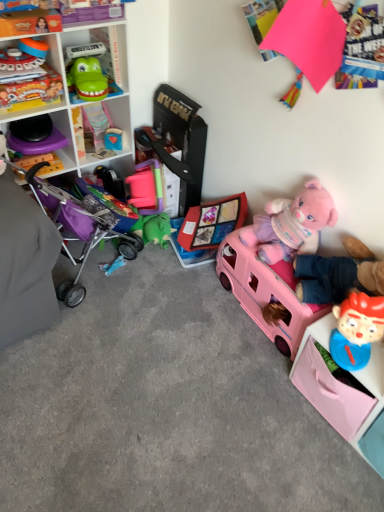
This screenshot has width=384, height=512. In order to click on matte green plastic toy at upper left, which is counted as the first toy, starting from the left in this screenshot , I will do `click(29, 88)`.

The width and height of the screenshot is (384, 512). What do you see at coordinates (344, 393) in the screenshot?
I see `pink plastic shelf at lower right, the 2th shelf viewed from the left` at bounding box center [344, 393].

In order to face matte plastic shelf at upper left, the second shelf when ordered from right to left, should I rotate leftwards or rightwards?

Turn left approximately 17.238 degrees to face it.

This screenshot has width=384, height=512. Find the location of `purple fabric stroller at left`. purple fabric stroller at left is located at coordinates (83, 224).

Which is behind, point (100, 229) or point (14, 61)?

The point (100, 229) is farther from the camera.

Are purple fabric stroller at left and matte green plastic toy at upper left, which is counted as the first toy, starting from the left, located far from each other?

Actually, purple fabric stroller at left and matte green plastic toy at upper left, which is counted as the first toy, starting from the left, are a little close together.

Is purple fabric stroller at left at the left side of matte green plastic toy at upper left, which is counted as the first toy, starting from the left?

Incorrect, purple fabric stroller at left is not on the left side of matte green plastic toy at upper left, which is counted as the first toy, starting from the left.

From a real-world perspective, is purple fabric stroller at left physically located above or below matte green plastic toy at upper left, which is the seventh toy from right to left?

purple fabric stroller at left is below matte green plastic toy at upper left, which is the seventh toy from right to left.

Which is closer, (55, 106) or (317, 391)?

Point (317, 391)

Looking at their sizes, would you say matte plastic shelf at upper left, which is the 2th shelf from bottom to top, is wider or thinner than pink plastic shelf at lower right, which is the first shelf in right-to-left order?

Considering their sizes, matte plastic shelf at upper left, which is the 2th shelf from bottom to top, looks slimmer than pink plastic shelf at lower right, which is the first shelf in right-to-left order.

Would you say matte plastic shelf at upper left, which is the 1th shelf in left-to-right order, is inside or outside pink plastic shelf at lower right, which is counted as the 2th shelf, starting from the top?

matte plastic shelf at upper left, which is the 1th shelf in left-to-right order, is not inside pink plastic shelf at lower right, which is counted as the 2th shelf, starting from the top, it's outside.

Does matte green plastic toy at upper left, which is counted as the first toy, starting from the left, have a lesser width compared to blue plastic toy at lower right, the seventh toy in the left-to-right sequence?

No, matte green plastic toy at upper left, which is counted as the first toy, starting from the left, is not thinner than blue plastic toy at lower right, the seventh toy in the left-to-right sequence.

Is matte green plastic toy at upper left, which is counted as the first toy, starting from the left, taller than blue plastic toy at lower right, the seventh toy in the left-to-right sequence?

Incorrect, the height of matte green plastic toy at upper left, which is counted as the first toy, starting from the left, is not larger of that of blue plastic toy at lower right, the seventh toy in the left-to-right sequence.

Based on the photo, from the image's perspective, would you say matte green plastic toy at upper left, which is the seventh toy from right to left, is shown under blue plastic toy at lower right, the seventh toy in the left-to-right sequence?

Incorrect, from the image's perspective, matte green plastic toy at upper left, which is the seventh toy from right to left, is higher than blue plastic toy at lower right, the seventh toy in the left-to-right sequence.

The width and height of the screenshot is (384, 512). Identify the location of the 6th toy counting from the left side of the blue plastic toy at lower right, which is the 1th toy from right to left. (29, 88).

Can you tell me how much green plastic toy at upper left, arranged as the first cabinet when viewed from the right, and purple plastic cabinet at left, positioned as the first cabinet in left-to-right order, differ in facing direction?

There is a 3.57-degree angle between the facing directions of green plastic toy at upper left, arranged as the first cabinet when viewed from the right, and purple plastic cabinet at left, positioned as the first cabinet in left-to-right order.

Looking at this image, considering the relative sizes of green plastic toy at upper left, the second cabinet in the left-to-right sequence, and purple plastic cabinet at left, positioned as the 2th cabinet in top-to-bottom order, in the image provided, is green plastic toy at upper left, the second cabinet in the left-to-right sequence, smaller than purple plastic cabinet at left, positioned as the 2th cabinet in top-to-bottom order,?

Correct, green plastic toy at upper left, the second cabinet in the left-to-right sequence, occupies less space than purple plastic cabinet at left, positioned as the 2th cabinet in top-to-bottom order.

Are green plastic toy at upper left, arranged as the first cabinet when viewed from the right, and purple plastic cabinet at left, positioned as the first cabinet in left-to-right order, far apart?

No.

Could you measure the distance between pink plastic toy car at lower right, which is counted as the third toy, starting from the right, and purple fabric stroller at left?

pink plastic toy car at lower right, which is counted as the third toy, starting from the right, and purple fabric stroller at left are 25.39 inches apart.

Which object is further away from the camera taking this photo, pink plastic toy car at lower right, which is counted as the third toy, starting from the right, or purple fabric stroller at left?

pink plastic toy car at lower right, which is counted as the third toy, starting from the right, is further away from the camera.

From the image's perspective, which is below, pink plastic toy car at lower right, which appears as the fifth toy when viewed from the left, or purple fabric stroller at left?

pink plastic toy car at lower right, which appears as the fifth toy when viewed from the left, is shown below in the image.

Is purple fabric stroller at left a part of pink plastic toy car at lower right, which appears as the fifth toy when viewed from the left?

No, purple fabric stroller at left is located outside of pink plastic toy car at lower right, which appears as the fifth toy when viewed from the left.

Considering the positions of point (100, 266) and point (93, 22), is point (100, 266) closer or farther from the camera than point (93, 22)?

Point (100, 266) appears to be farther away from the viewer than point (93, 22).

Considering the positions of objects blue rubber toy at lower left, the 4th toy in the left-to-right sequence, and matte plastic shelf at upper left, which is the 1th shelf in left-to-right order, in the image provided, who is more to the left, blue rubber toy at lower left, the 4th toy in the left-to-right sequence, or matte plastic shelf at upper left, which is the 1th shelf in left-to-right order,?

Positioned to the left is matte plastic shelf at upper left, which is the 1th shelf in left-to-right order.

Starting from the matte plastic shelf at upper left, which is the 2th shelf from bottom to top, which toy is the 3rd one to the right? Please provide its 2D coordinates.

[(112, 265)]

How distant is blue rubber toy at lower left, the 4th toy in the left-to-right sequence, from matte plastic shelf at upper left, which is the 2th shelf from bottom to top?

78.60 centimeters.

From the image's perspective, would you say matte green plastic toy at upper left, which is counted as the first toy, starting from the left, is positioned over pink plush bear at right, which ranks as the second toy in right-to-left order?

Yes, from the image's perspective, matte green plastic toy at upper left, which is counted as the first toy, starting from the left, is over pink plush bear at right, which ranks as the second toy in right-to-left order.

The width and height of the screenshot is (384, 512). I want to click on toy that is the 5th object to the right of the matte green plastic toy at upper left, which is counted as the first toy, starting from the left, starting at the anchor, so click(292, 224).

Is matte green plastic toy at upper left, which is the seventh toy from right to left, inside or outside of pink plush bear at right, which ranks as the second toy in right-to-left order?

matte green plastic toy at upper left, which is the seventh toy from right to left, is not enclosed by pink plush bear at right, which ranks as the second toy in right-to-left order.

Locate an element on the screen. The image size is (384, 512). toy that is the 2nd one when counting upward from the purple fabric stroller at left (from the image's perspective) is located at coordinates (29, 88).

At what (x,y) coordinates should I click in order to perform the action: click on shelf in front of the matte plastic shelf at upper left, which is the 1th shelf in left-to-right order. Please return your answer as a coordinate pair (x, y). Image resolution: width=384 pixels, height=512 pixels. Looking at the image, I should click on (344, 393).

Looking at the image, which one is located further to green rubbery toy at upper left, placed as the 2th toy when sorted from left to right, matte plastic shelf at upper left, the 1th shelf from the top, or blue rubber toy at lower left, which is counted as the fourth toy, starting from the right?

blue rubber toy at lower left, which is counted as the fourth toy, starting from the right.

Looking at the image, which one is located closer to pink plastic shelf at lower right, which is counted as the 2th shelf, starting from the top, rubber duck at center, placed as the 5th toy when sorted from right to left, or blue plastic toy at lower right, which is the 1th toy from right to left?

blue plastic toy at lower right, which is the 1th toy from right to left, is closer to pink plastic shelf at lower right, which is counted as the 2th shelf, starting from the top.

Which object lies further to the anchor point purple fabric stroller at left, blue plastic toy at lower right, which is the 1th toy from right to left, or pink plush bear at right, which appears as the sixth toy when viewed from the left?

Among the two, blue plastic toy at lower right, which is the 1th toy from right to left, is located further to purple fabric stroller at left.

Based on the photo, when comparing their distances from pink plastic toy car at lower right, which is counted as the third toy, starting from the right, does purple fabric stroller at left or blue rubber toy at lower left, the 4th toy in the left-to-right sequence, seem further?

The object further to pink plastic toy car at lower right, which is counted as the third toy, starting from the right, is blue rubber toy at lower left, the 4th toy in the left-to-right sequence.

From the picture: When comparing their distances from purple fabric stroller at left, does blue rubber toy at lower left, which is counted as the fourth toy, starting from the right, or rubber duck at center, placed as the 5th toy when sorted from right to left, seem further?

Among the two, rubber duck at center, placed as the 5th toy when sorted from right to left, is located further to purple fabric stroller at left.

Estimate the real-world distances between objects in this image. Which object is further from blue plastic toy at lower right, the seventh toy in the left-to-right sequence, green plastic toy at upper left, arranged as the first cabinet when viewed from the right, or pink plastic toy car at lower right, which is counted as the third toy, starting from the right?

Based on the image, green plastic toy at upper left, arranged as the first cabinet when viewed from the right, appears to be further to blue plastic toy at lower right, the seventh toy in the left-to-right sequence.

When comparing their distances from pink plastic toy car at lower right, which is counted as the third toy, starting from the right, does green rubbery toy at upper left, placed as the 2th toy when sorted from left to right, or rubber duck at center, which is the 3th toy in left-to-right order, seem further?

green rubbery toy at upper left, placed as the 2th toy when sorted from left to right.

When comparing their distances from purple fabric stroller at left, does pink plastic toy car at lower right, which is counted as the third toy, starting from the right, or blue rubber toy at lower left, which is counted as the fourth toy, starting from the right, seem closer?

blue rubber toy at lower left, which is counted as the fourth toy, starting from the right, is positioned closer to the anchor purple fabric stroller at left.

Locate an element on the screen. The height and width of the screenshot is (512, 384). cabinet between green plastic toy at upper left, the 2th cabinet from the bottom, and blue rubber toy at lower left, the 4th toy in the left-to-right sequence, vertically is located at coordinates (37, 146).

At what (x,y) coordinates should I click in order to perform the action: click on baby carriage situated between purple plastic cabinet at left, which is the first cabinet from bottom to top, and pink plush bear at right, which appears as the sixth toy when viewed from the left, from left to right. Please return your answer as a coordinate pair (x, y). The width and height of the screenshot is (384, 512). Looking at the image, I should click on (83, 224).

The image size is (384, 512). I want to click on shelf located between purple plastic cabinet at left, positioned as the 2th cabinet in top-to-bottom order, and pink plastic toy car at lower right, which is counted as the third toy, starting from the right, in the left-right direction, so click(x=68, y=88).

Identify the location of shelf that lies between green plastic toy at upper left, the 2th cabinet from the bottom, and purple fabric stroller at left from top to bottom. (68, 88).